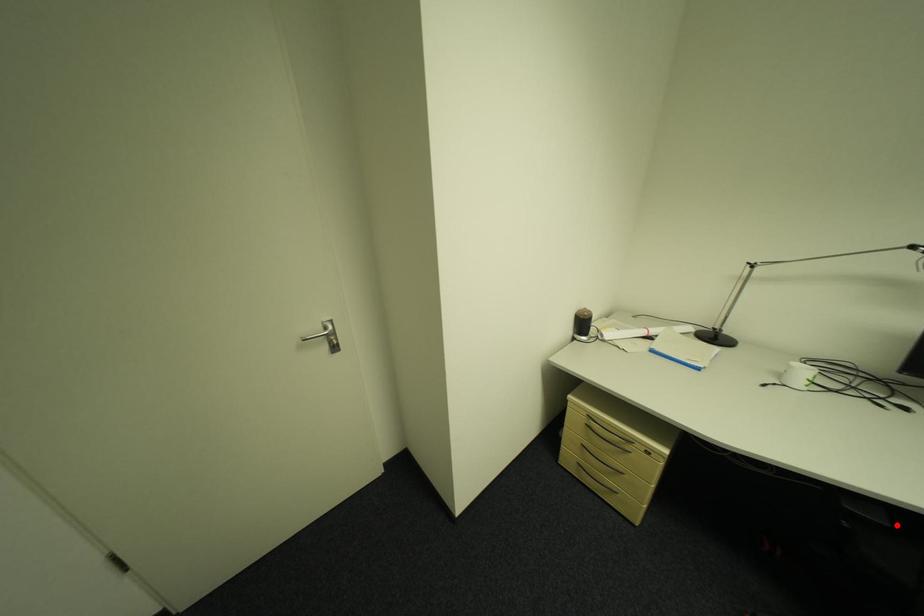
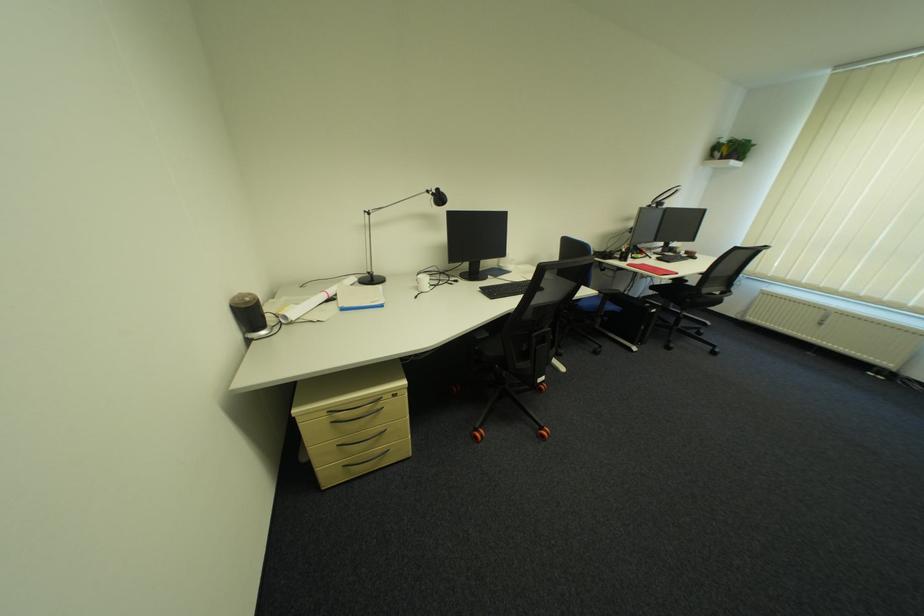
Where in the second image is the point corresponding to the highlighted location from the first image?

(497, 334)